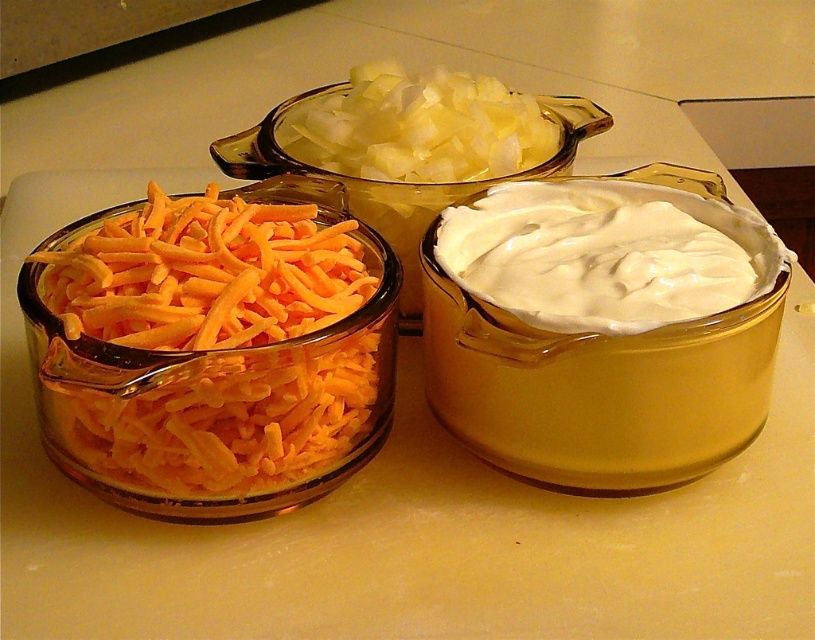
Question: Among these points, which one is farthest from the camera?

Choices:
 (A) (576, 291)
 (B) (183, 230)

Answer: (B)

Question: Which object is farther from the camera taking this photo?

Choices:
 (A) white creamy spread at center
 (B) orange shredded cheese at lower left

Answer: (A)

Question: Among these points, which one is nearest to the camera?

Choices:
 (A) (271, 256)
 (B) (763, 282)

Answer: (A)

Question: Is orange shredded cheese at lower left to the left of white creamy spread at center from the viewer's perspective?

Choices:
 (A) yes
 (B) no

Answer: (A)

Question: Is orange shredded cheese at lower left wider than white creamy spread at center?

Choices:
 (A) yes
 (B) no

Answer: (A)

Question: Considering the relative positions of orange shredded cheese at lower left and white creamy spread at center in the image provided, where is orange shredded cheese at lower left located with respect to white creamy spread at center?

Choices:
 (A) below
 (B) above

Answer: (A)